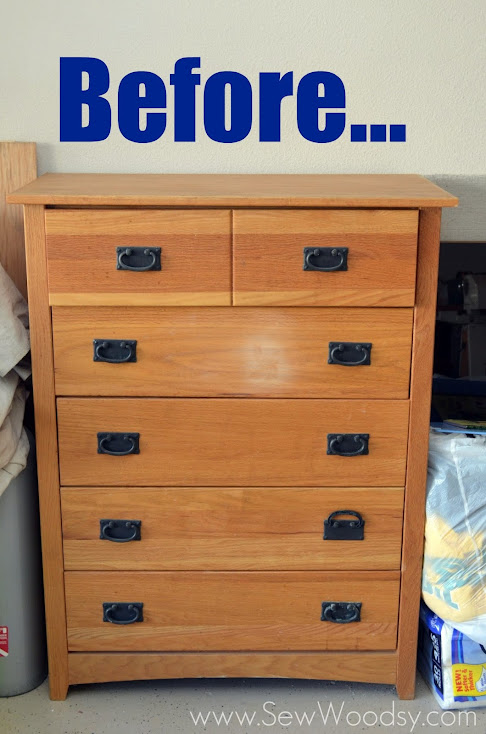
Where is `toilet paper`? Image resolution: width=486 pixels, height=734 pixels. toilet paper is located at coordinates (447, 647).